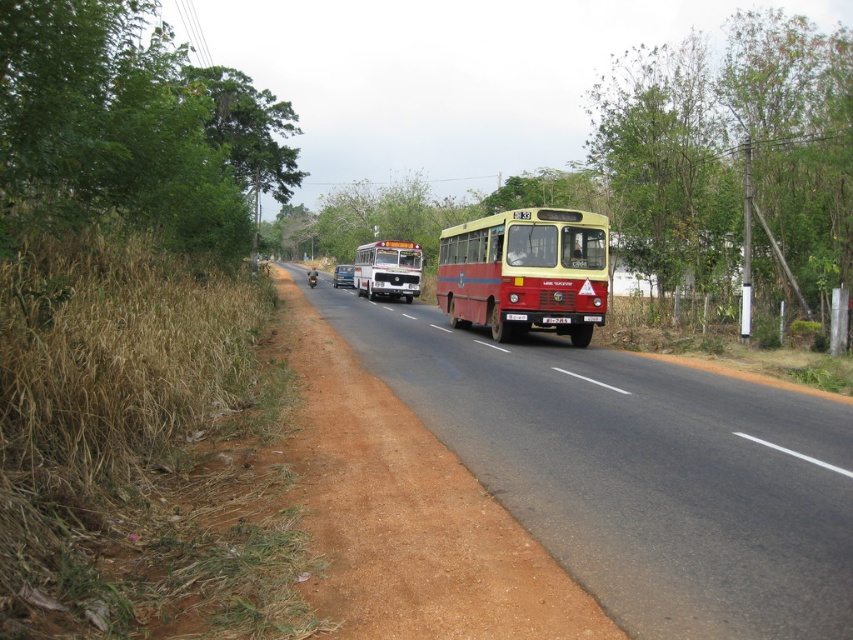
You are a pedestrian standing on the rural road and see the green leafy tree at center and the matte yellow bus at center. Which object is closer to you?

The green leafy tree at center is closer to you because it is in front of the matte yellow bus at center.